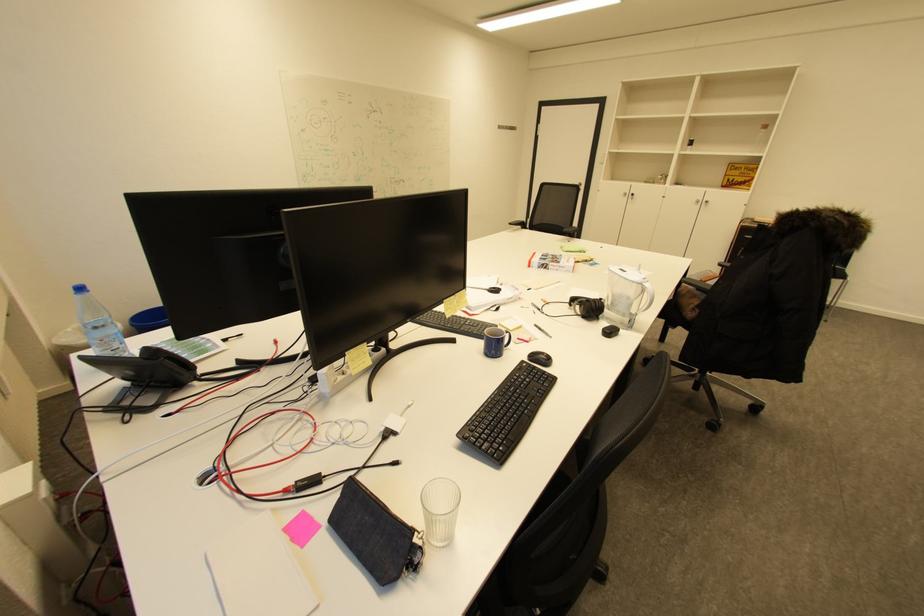
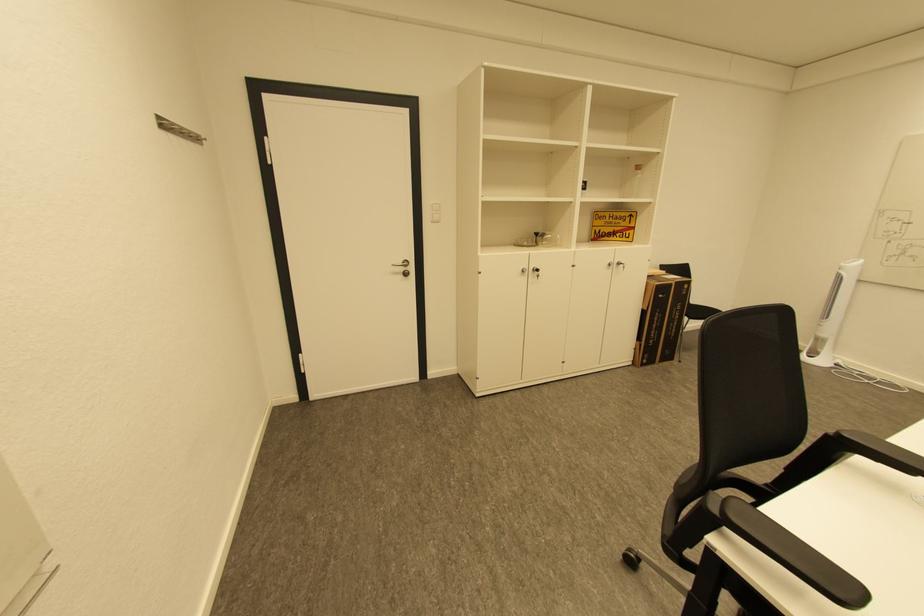
Locate, in the second image, the point that corresponds to [736,180] in the first image.

(603, 233)